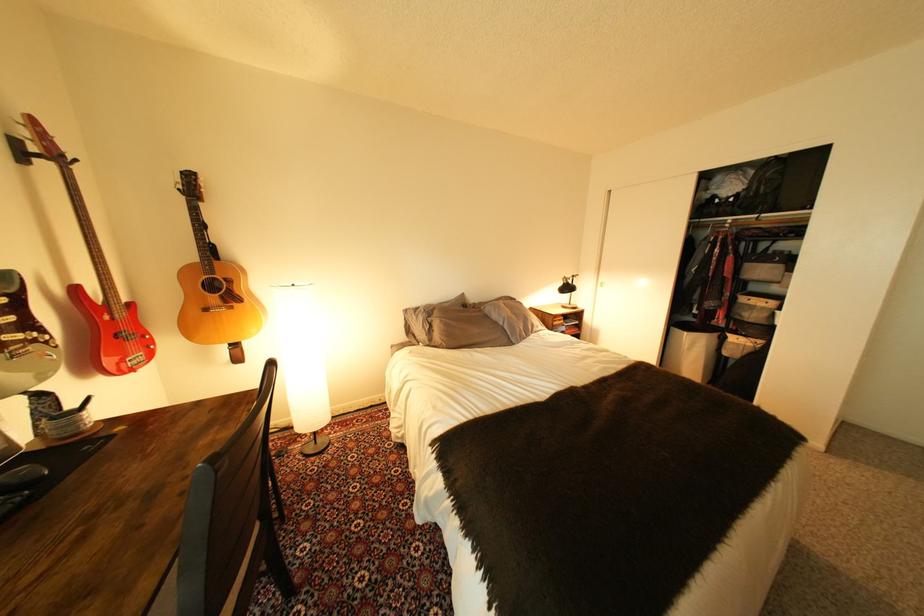
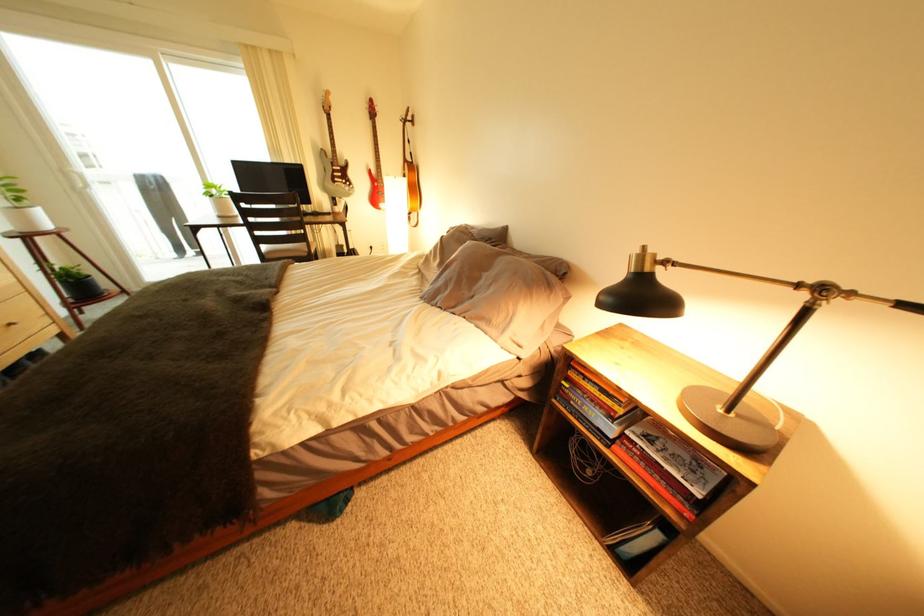
Where in the second image is the point corresponding to (590,323) from the first image?

(712, 496)